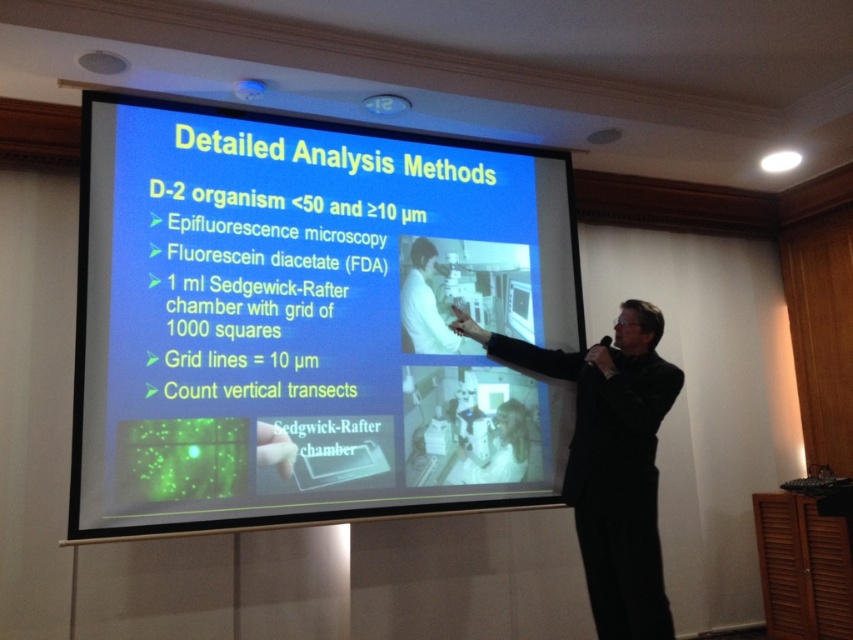
You are an attendee in the conference room and want to take a photo of the blue matte projector screen at center. However, your phone camera has a maximum zoom range of 2 meters. Given your current position, can you capture the entire screen without moving closer?

The blue matte projector screen at center is located at point (306, 321), so you can capture the entire screen without moving closer as long as your current position is within the 2 meters zoom range of the screen.

You are an attendee at the presentation and need to sit down. There is a chair between the black suit at center and the white lab coat at center. Will the chair fit between them?

The black suit at center might be wider than white lab coat at center, so the chair may not fit between them due to the possible width difference.